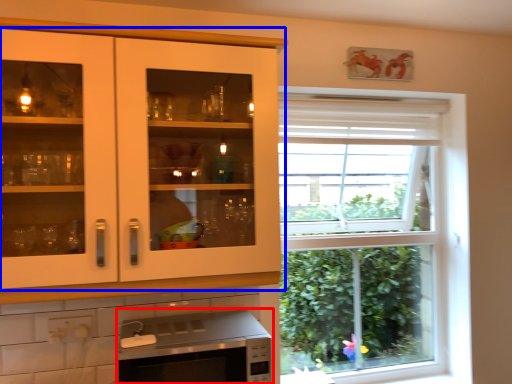
Question: Which object appears closest to the camera in this image, microwave oven (highlighted by a red box) or cabinetry (highlighted by a blue box)?

Choices:
 (A) microwave oven
 (B) cabinetry

Answer: (B)